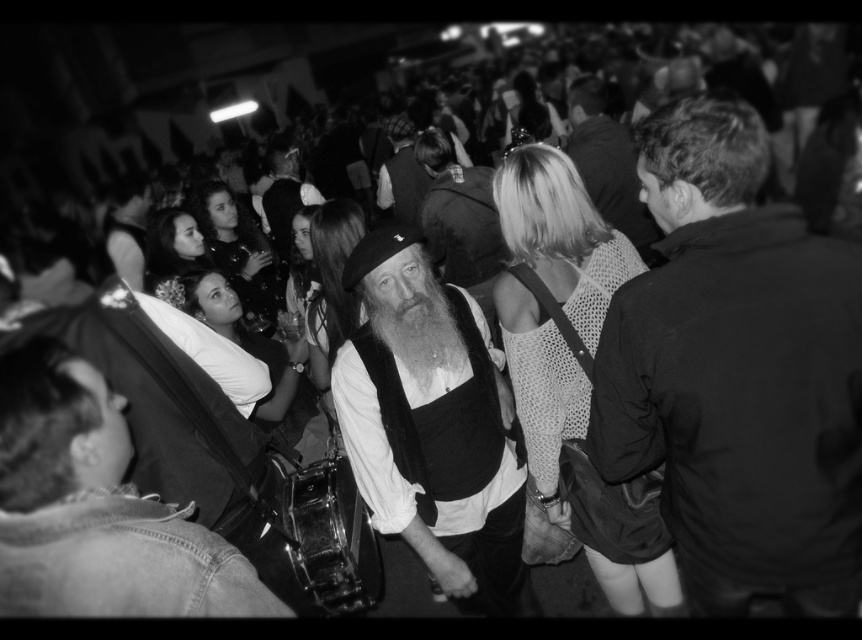
Question: From the image, what is the correct spatial relationship of dark fabric jacket at center in relation to denim jacket at lower left?

Choices:
 (A) left
 (B) right

Answer: (B)

Question: Estimate the real-world distances between objects in this image. Which object is closer to the smooth leather jacket at upper center?

Choices:
 (A) matte black vest at center
 (B) dark fabric jacket at center
 (C) smooth leather jacket at center

Answer: (C)

Question: Estimate the real-world distances between objects in this image. Which object is closer to the dark fabric jacket at center?

Choices:
 (A) smooth leather jacket at center
 (B) smooth leather jacket at upper center

Answer: (B)

Question: Can you confirm if dark fabric jacket at center is positioned to the left of denim jacket at lower left?

Choices:
 (A) yes
 (B) no

Answer: (B)

Question: Can you confirm if denim jacket at lower left is thinner than smooth leather jacket at center?

Choices:
 (A) no
 (B) yes

Answer: (B)

Question: Which object appears closest to the camera in this image?

Choices:
 (A) smooth leather jacket at upper center
 (B) dark fabric jacket at center
 (C) smooth leather jacket at center

Answer: (B)